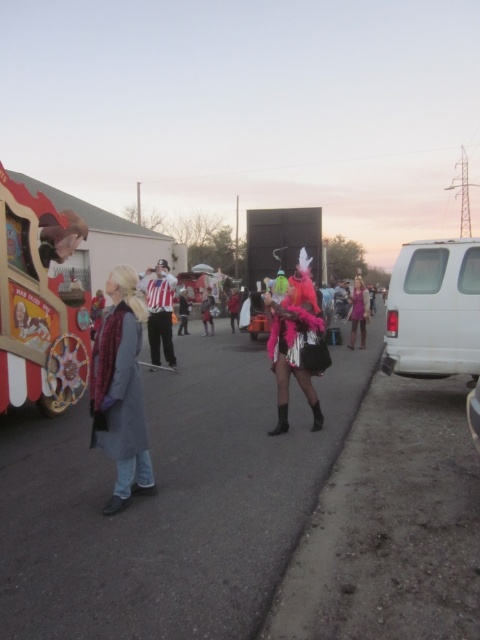
Is denim jacket at lower left closer to the viewer compared to fuzzy pink costume at center?

Yes, denim jacket at lower left is closer to the viewer.

Is denim jacket at lower left to the right of fuzzy pink costume at center from the viewer's perspective?

In fact, denim jacket at lower left is to the left of fuzzy pink costume at center.

Which is behind, point (135, 333) or point (279, 310)?

The point (279, 310) is more distant.

Where is `denim jacket at lower left`? denim jacket at lower left is located at coordinates 120,390.

Does pink satin dress at center lie in front of purple satin dress at center?

Yes, pink satin dress at center is closer to the viewer.

Is pink satin dress at center positioned at the back of purple satin dress at center?

No.

Which is behind, point (364, 339) or point (356, 288)?

Positioned behind is point (364, 339).

Where is `pink satin dress at center`? This screenshot has height=640, width=480. pink satin dress at center is located at coordinates (359, 312).

Is point (16, 396) in front of point (153, 332)?

Yes, point (16, 396) is in front of point (153, 332).

Does wooden painted food truck at left have a greater height compared to striped fabric shirt at center?

Correct, wooden painted food truck at left is much taller as striped fabric shirt at center.

Between point (67, 292) and point (163, 273), which one is positioned behind?

The point (163, 273) is more distant.

You are a GUI agent. You are given a task and a screenshot of the screen. Output one action in this format:
    pyautogui.click(x=<x>, y=<y>)
    Task: Click on the wooden painted food truck at left
    The width and height of the screenshot is (480, 640).
    Given the screenshot: What is the action you would take?
    pyautogui.click(x=39, y=304)